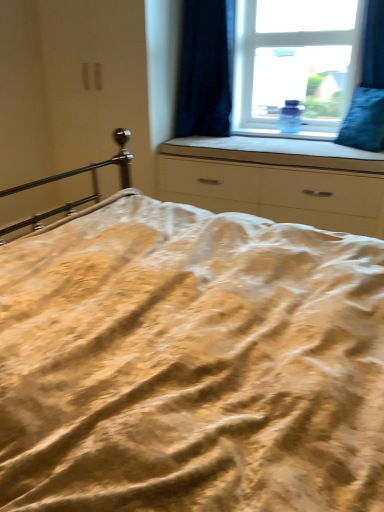
You are a GUI agent. You are given a task and a screenshot of the screen. Output one action in this format:
    pyautogui.click(x=<x>, y=<y>)
    Task: Click on the white matte chest of drawers at center
    The width and height of the screenshot is (384, 512).
    Given the screenshot: What is the action you would take?
    pyautogui.click(x=277, y=181)

This screenshot has height=512, width=384. What do you see at coordinates (277, 152) in the screenshot? I see `white fabric at center` at bounding box center [277, 152].

The width and height of the screenshot is (384, 512). Describe the element at coordinates (364, 121) in the screenshot. I see `blue velvet pillow at right` at that location.

Measure the distance between point (x=373, y=92) and camera.

8.87 feet.

Identify the location of dark blue velvet curtain at upper right. This screenshot has width=384, height=512. (204, 71).

Is transparent glass window at upper center shorter than white matte chest of drawers at center?

No.

Is point (234, 91) less distant than point (228, 207)?

No.

Looking at this image, from a real-world perspective, which object stands above the other?

In real-world perspective, transparent glass window at upper center is above.

Is transparent glass window at upper center far away from white matte chest of drawers at center?

They are positioned close to each other.

From the picture: Is blue velvet pillow at right next to dark blue velvet curtain at upper right?

blue velvet pillow at right and dark blue velvet curtain at upper right are clearly separated.

Considering the relative positions of blue velvet pillow at right and dark blue velvet curtain at upper right in the image provided, is blue velvet pillow at right to the right of dark blue velvet curtain at upper right from the viewer's perspective?

Correct, you'll find blue velvet pillow at right to the right of dark blue velvet curtain at upper right.

Which object is closer to the camera taking this photo, blue velvet pillow at right or dark blue velvet curtain at upper right?

blue velvet pillow at right.

Does blue velvet pillow at right turn towards dark blue velvet curtain at upper right?

No, blue velvet pillow at right is not aimed at dark blue velvet curtain at upper right.

Between blue velvet pillow at right and white fabric at center, which one has more height?

blue velvet pillow at right.

Which object is thinner, blue velvet pillow at right or white fabric at center?

Thinner between the two is blue velvet pillow at right.

Which point is more distant from viewer, (373, 101) or (267, 149)?

The point (267, 149) is farther from the camera.

From a real-world perspective, which object rests below the other?

white fabric at center is physically lower.

Can you confirm if white fabric at center is smaller than white matte chest of drawers at center?

Indeed, white fabric at center has a smaller size compared to white matte chest of drawers at center.

Is white matte chest of drawers at center a part of white fabric at center?

That's incorrect, white matte chest of drawers at center is not inside white fabric at center.

Which is more to the left, white fabric at center or blue velvet pillow at right?

white fabric at center is more to the left.

You are a GUI agent. You are given a task and a screenshot of the screen. Output one action in this format:
    pyautogui.click(x=<x>, y=<y>)
    Task: Click on the pillow that appears above the white fabric at center (from a real-world perspective)
    Image resolution: width=384 pixels, height=512 pixels.
    Given the screenshot: What is the action you would take?
    pyautogui.click(x=364, y=121)

Is white fabric at center inside or outside of blue velvet pillow at right?

white fabric at center is spatially situated outside blue velvet pillow at right.

Is dark blue velvet curtain at upper right in front of white fabric at center?

That is False.

Is dark blue velvet curtain at upper right facing towards white fabric at center?

No, dark blue velvet curtain at upper right does not turn towards white fabric at center.

Between dark blue velvet curtain at upper right and white fabric at center, which one has smaller size?

Smaller between the two is white fabric at center.

Which is more to the left, dark blue velvet curtain at upper right or white fabric at center?

From the viewer's perspective, dark blue velvet curtain at upper right appears more on the left side.

From the image's perspective, which object appears higher, white matte chest of drawers at center or white fabric at center?

white fabric at center appears higher in the image.

Considering the relative sizes of white matte chest of drawers at center and white fabric at center in the image provided, is white matte chest of drawers at center thinner than white fabric at center?

In fact, white matte chest of drawers at center might be wider than white fabric at center.

Choose the correct answer: Is white matte chest of drawers at center inside white fabric at center or outside it?

white matte chest of drawers at center lies outside white fabric at center.

Measure the distance from white matte chest of drawers at center to white fabric at center.

4.44 inches.

This screenshot has width=384, height=512. I want to click on window above the white matte chest of drawers at center (from a real-world perspective), so click(295, 63).

The height and width of the screenshot is (512, 384). Identify the location of curtain above the blue velvet pillow at right (from the image's perspective). (204, 71).

Considering their positions, is dark blue velvet curtain at upper right positioned closer to white matte chest of drawers at center than transparent glass window at upper center?

Based on the image, dark blue velvet curtain at upper right appears to be nearer to white matte chest of drawers at center.

When comparing their distances from dark blue velvet curtain at upper right, does white fabric at center or blue velvet pillow at right seem further?

blue velvet pillow at right.

Estimate the real-world distances between objects in this image. Which object is closer to transparent glass window at upper center, dark blue velvet curtain at upper right or white fabric at center?

Among the two, dark blue velvet curtain at upper right is located nearer to transparent glass window at upper center.

Which object lies further to the anchor point transparent glass window at upper center, white fabric at center or dark blue velvet curtain at upper right?

white fabric at center is positioned further to the anchor transparent glass window at upper center.

When comparing their distances from white fabric at center, does white matte chest of drawers at center or dark blue velvet curtain at upper right seem closer?

Based on the image, white matte chest of drawers at center appears to be nearer to white fabric at center.

Looking at the image, which one is located further to white fabric at center, blue velvet pillow at right or white matte chest of drawers at center?

blue velvet pillow at right lies further to white fabric at center than the other object.

From the image, which object appears to be nearer to white matte chest of drawers at center, blue velvet pillow at right or transparent glass window at upper center?

Based on the image, blue velvet pillow at right appears to be nearer to white matte chest of drawers at center.

Considering their positions, is white fabric at center positioned further to blue velvet pillow at right than transparent glass window at upper center?

Among the two, transparent glass window at upper center is located further to blue velvet pillow at right.

Where is `curtain that lies between transparent glass window at upper center and white fabric at center from top to bottom`? curtain that lies between transparent glass window at upper center and white fabric at center from top to bottom is located at coordinates (204, 71).

Where is `pillow between transparent glass window at upper center and white matte chest of drawers at center in the vertical direction`? The width and height of the screenshot is (384, 512). pillow between transparent glass window at upper center and white matte chest of drawers at center in the vertical direction is located at coordinates (364, 121).

The height and width of the screenshot is (512, 384). Identify the location of chest of drawers between dark blue velvet curtain at upper right and blue velvet pillow at right in the horizontal direction. (277, 181).

Locate an element on the screen. Image resolution: width=384 pixels, height=512 pixels. the chest of drawers located between white fabric at center and blue velvet pillow at right in the left-right direction is located at coordinates (277, 181).